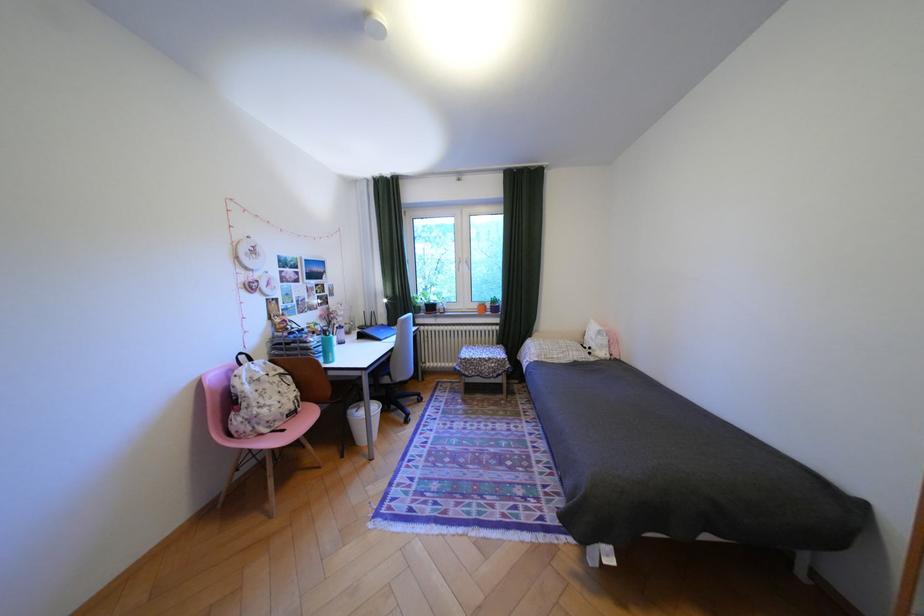
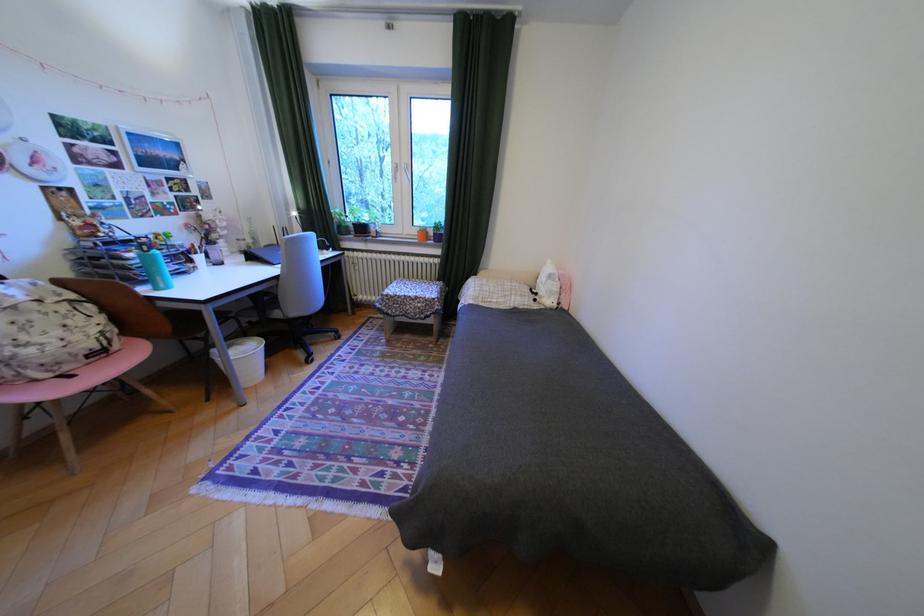
Where in the second image is the point corresponding to the point at 403,350 from the first image?

(288, 278)